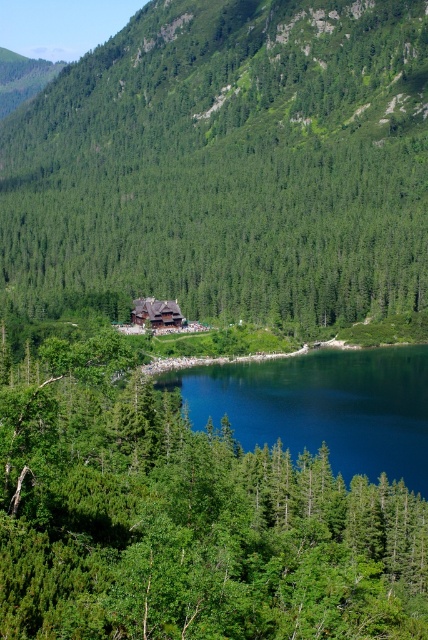
Is point (377, 524) positioned in front of point (142, 307)?

Yes.

Is point (98, 516) farther from viewer compared to point (151, 298)?

No, (98, 516) is in front of (151, 298).

Image resolution: width=428 pixels, height=640 pixels. Describe the element at coordinates (184, 518) in the screenshot. I see `green leafy tree at center` at that location.

The height and width of the screenshot is (640, 428). Identify the location of green leafy tree at center. (184, 518).

How far apart are green matte tree at center and deep blue water at center?

green matte tree at center and deep blue water at center are 89.66 meters apart.

Is point (267, 140) behind point (285, 388)?

Yes.

This screenshot has width=428, height=640. I want to click on green matte tree at center, so [x=231, y=163].

Is green leafy tree at center smaller than deep blue water at center?

No.

Can you confirm if green leafy tree at center is positioned to the right of deep blue water at center?

Incorrect, green leafy tree at center is not on the right side of deep blue water at center.

Measure the distance between green leafy tree at center and camera.

green leafy tree at center is 78.06 feet from camera.

The width and height of the screenshot is (428, 640). Find the location of `green leafy tree at center`. green leafy tree at center is located at coordinates (184, 518).